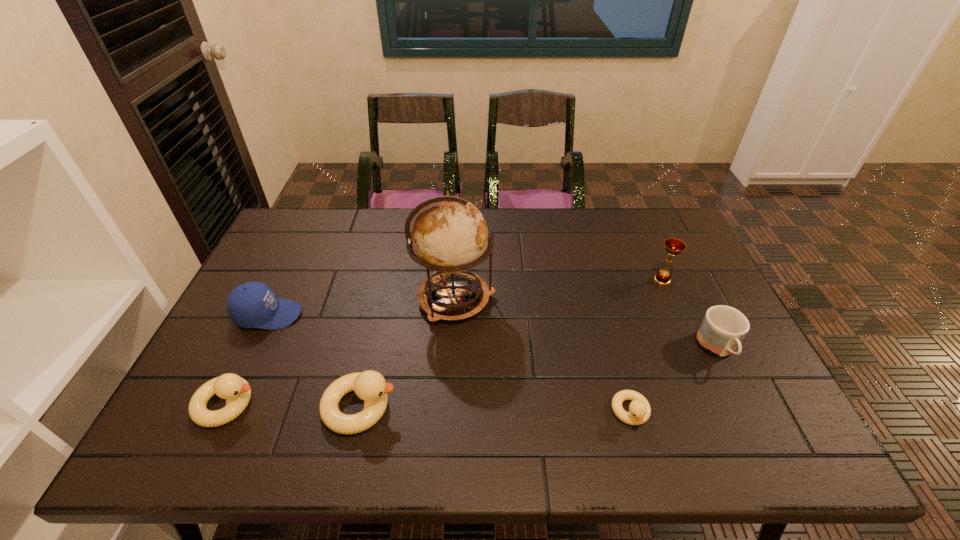
Where is `vacant region located on the side with the handle of the mug`? The width and height of the screenshot is (960, 540). vacant region located on the side with the handle of the mug is located at coordinates (739, 392).

Image resolution: width=960 pixels, height=540 pixels. Identify the location of vacant space located on the back of the chalice. (634, 215).

Where is `vacant area situated 0.210m on the front-facing side of the cap`? Image resolution: width=960 pixels, height=540 pixels. vacant area situated 0.210m on the front-facing side of the cap is located at coordinates (376, 315).

Image resolution: width=960 pixels, height=540 pixels. I want to click on vacant position located at the center of the tallest object, so click(x=526, y=299).

Image resolution: width=960 pixels, height=540 pixels. I want to click on duckling situated at the left edge, so click(x=236, y=391).

You are a GUI agent. You are given a task and a screenshot of the screen. Output one action in this format:
    pyautogui.click(x=<x>, y=<y>)
    Task: Click on the cap at the left edge
    
    Given the screenshot: What is the action you would take?
    pyautogui.click(x=252, y=304)

Identify the location of mug situated at the right edge. (723, 328).

I want to click on chalice positioned at the right edge, so click(673, 246).

Where is `object located at the near left corner`? object located at the near left corner is located at coordinates (236, 391).

The height and width of the screenshot is (540, 960). What are the coordinates of `vacant area at the far edge` in the screenshot? It's located at (357, 251).